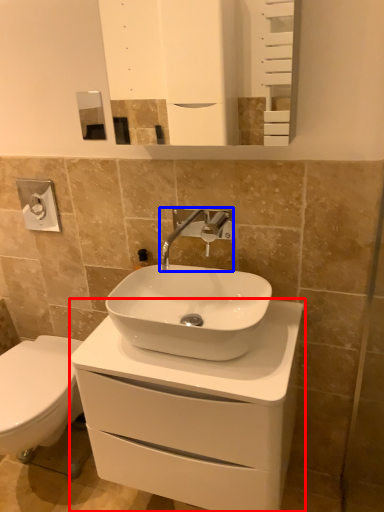
Question: Which object appears closest to the camera in this image, bathroom cabinet (highlighted by a red box) or tap (highlighted by a blue box)?

Choices:
 (A) bathroom cabinet
 (B) tap

Answer: (A)